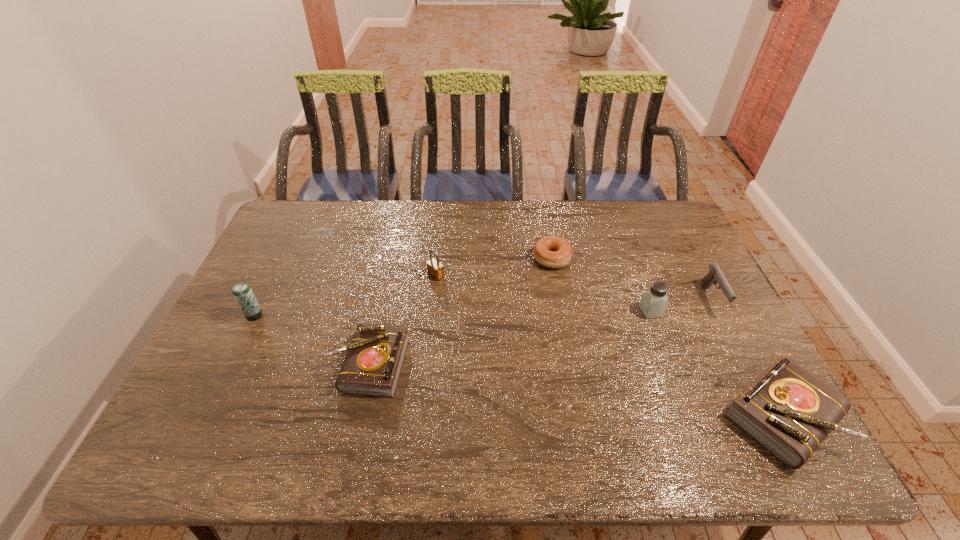
Identify the location of blank area in the image that satisfies the following two spatial constraints: 1. at the barrel of the taller diary; 2. on the left side of the pistol. Image resolution: width=960 pixels, height=540 pixels. (772, 416).